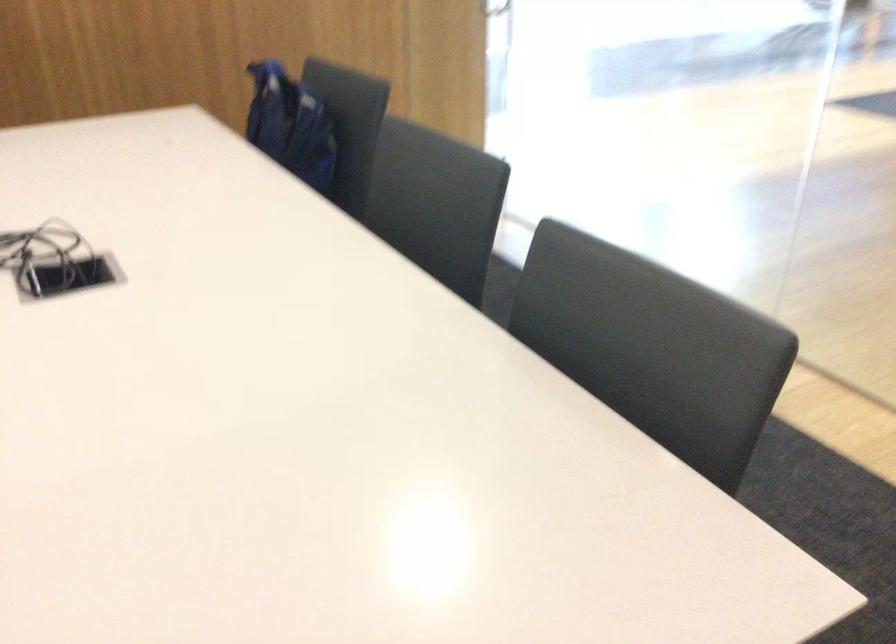
Identify the location of blue backpack. (289, 125).